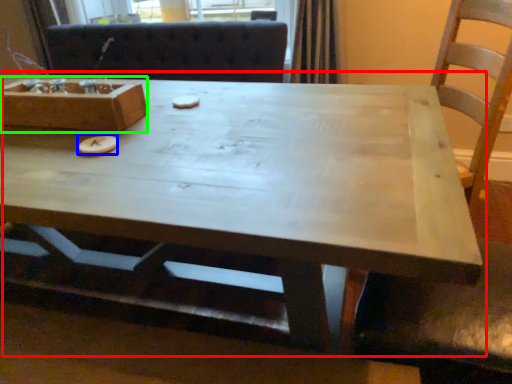
Question: Which object is positioned closest to coffee table (highlighted by a red box)? Select from food (highlighted by a blue box) and box (highlighted by a green box).

Choices:
 (A) food
 (B) box

Answer: (B)